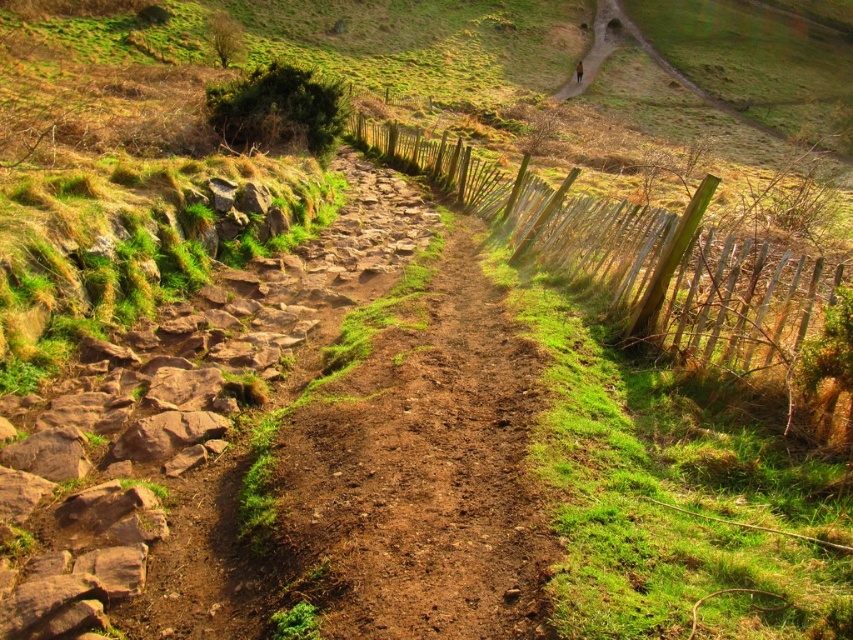
Question: Is brown dirt track at center smaller than wooden picket fence at center-right?

Choices:
 (A) yes
 (B) no

Answer: (A)

Question: Does brown dirt track at center appear under wooden picket fence at center-right?

Choices:
 (A) no
 (B) yes

Answer: (B)

Question: Can you confirm if brown dirt track at center is smaller than wooden picket fence at center-right?

Choices:
 (A) yes
 (B) no

Answer: (A)

Question: Which of the following is the farthest from the observer?

Choices:
 (A) (540, 216)
 (B) (444, 529)

Answer: (A)

Question: Among these objects, which one is nearest to the camera?

Choices:
 (A) brown dirt track at center
 (B) wooden picket fence at center-right

Answer: (A)